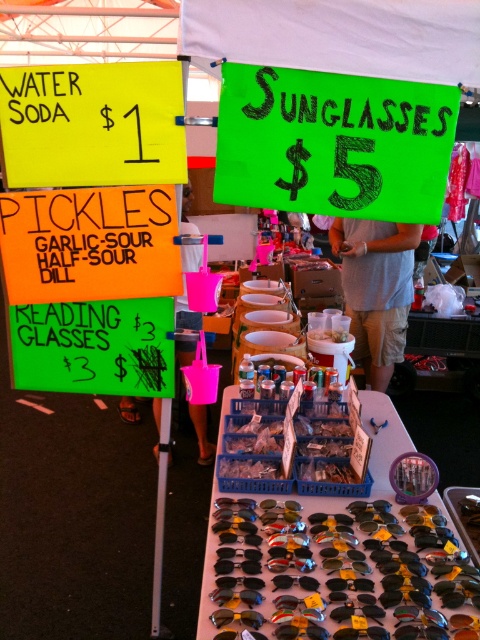
You are a customer at the market stall and want to pick up the pink fabric bag at lower center. You are currently standing next to the green paper sign at upper right. Can you reach the bag without moving your feet?

The green paper sign at upper right and pink fabric bag at lower center are 49.28 centimeters apart. Since the distance is less than an average person arm length, you can reach the pink fabric bag at lower center without moving your feet.

You are standing at the market stall and want to know which of the two points, point (239, 188) or point (350, 588), is closer to you. Based on their positions, which point is nearer?

Point (239, 188) is further to the camera than point (350, 588), so the closer point to you is point (350, 588).

What is the spatial relationship between the black plastic goggles at center and the green paper sign at upper right in the market stall setup?

The black plastic goggles at center is behind the green paper sign at upper right.